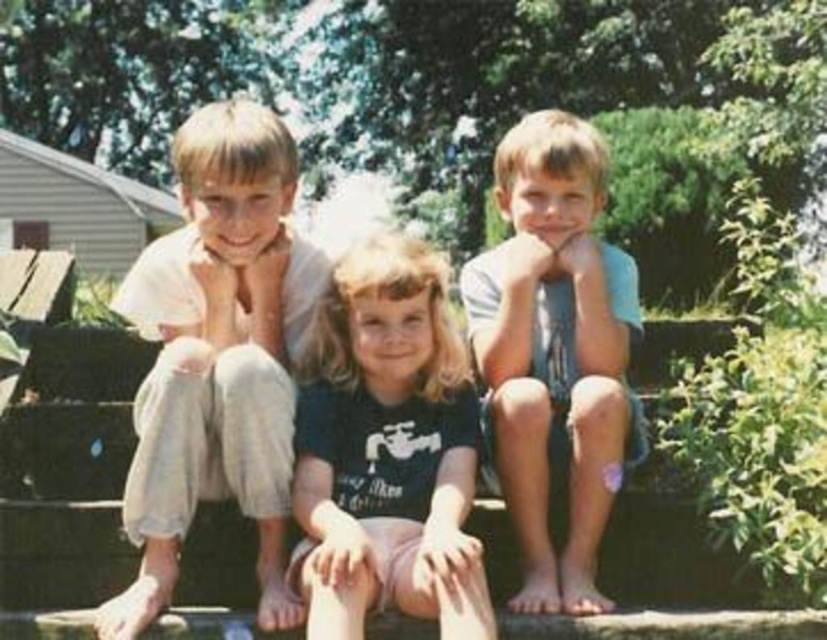
Question: Which object is farther from the camera taking this photo?

Choices:
 (A) light beige cotton shirt at left
 (B) black cotton shirt at center

Answer: (A)

Question: Is black cotton shirt at center thinner than light blue denim shorts at center?

Choices:
 (A) no
 (B) yes

Answer: (A)

Question: Is light beige cotton shirt at left below light blue denim shorts at center?

Choices:
 (A) no
 (B) yes

Answer: (A)

Question: Which object is the closest to the black cotton shirt at center?

Choices:
 (A) light blue denim shorts at center
 (B) light beige cotton shirt at left

Answer: (B)

Question: Which point is farther to the camera?

Choices:
 (A) light blue denim shorts at center
 (B) black cotton shirt at center
 (C) light beige cotton shirt at left

Answer: (A)

Question: Where is black cotton shirt at center located in relation to light blue denim shorts at center in the image?

Choices:
 (A) above
 (B) below

Answer: (B)